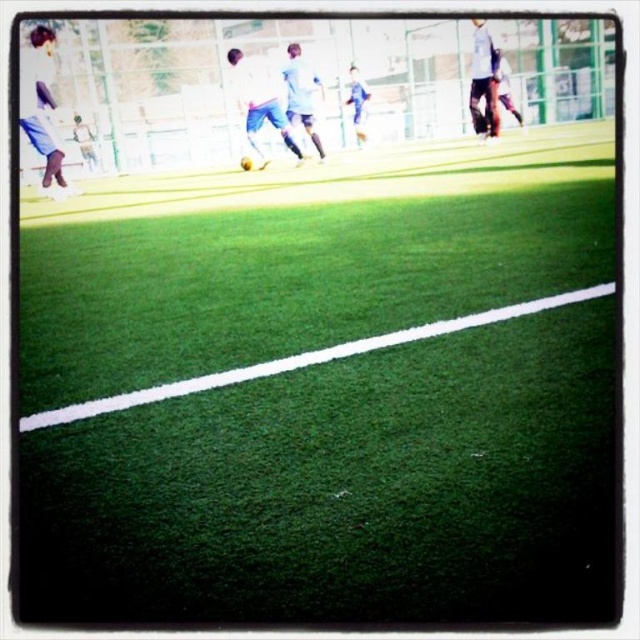
Question: Is green artificial turf at center further to camera compared to light blue jersey at center?

Choices:
 (A) yes
 (B) no

Answer: (B)

Question: Can you confirm if light blue fabric pants at left is smaller than white matte soccer player at center?

Choices:
 (A) no
 (B) yes

Answer: (A)

Question: Which point is closer to the camera?

Choices:
 (A) white matte soccer player at center
 (B) green artificial turf at center
 (C) light blue jersey at center
 (D) blue jersey at center

Answer: (B)

Question: Among these objects, which one is farthest from the camera?

Choices:
 (A) blue jersey at center
 (B) white matte shirt at upper right
 (C) white matte soccer player at center
 (D) light blue fabric pants at left

Answer: (A)

Question: Observing the image, what is the correct spatial positioning of white matte shirt at upper right in reference to white matte soccer player at center?

Choices:
 (A) right
 (B) left

Answer: (A)

Question: Which object is closer to the camera taking this photo?

Choices:
 (A) light blue fabric pants at left
 (B) white matte soccer player at center
 (C) green artificial turf at center
 (D) white matte shirt at upper right

Answer: (C)